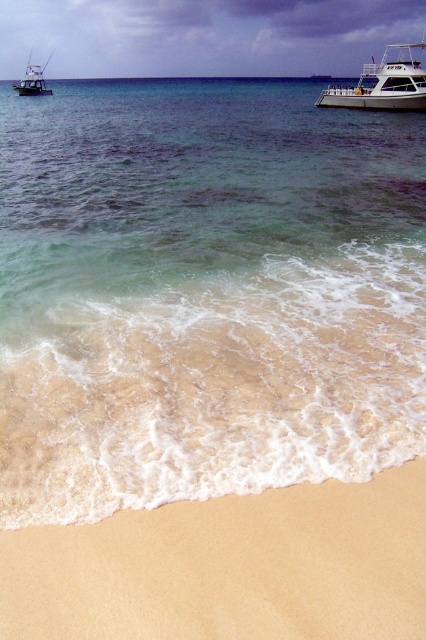
Between beige sandy beach at lower center and brushed metal boat at upper left, which one appears on the right side from the viewer's perspective?

beige sandy beach at lower center is more to the right.

Is the position of beige sandy beach at lower center less distant than that of brushed metal boat at upper left?

Yes, it is in front of brushed metal boat at upper left.

Is point (236, 620) less distant than point (28, 92)?

Yes, it is.

You are a GUI agent. You are given a task and a screenshot of the screen. Output one action in this format:
    pyautogui.click(x=<x>, y=<y>)
    Task: Click on the beige sandy beach at lower center
    Image resolution: width=426 pixels, height=640 pixels.
    Given the screenshot: What is the action you would take?
    (x=230, y=566)

Does beige sandy beach at lower center have a lesser width compared to white glossy boat at upper right?

Correct, beige sandy beach at lower center's width is less than white glossy boat at upper right's.

Based on the photo, who is positioned more to the left, beige sandy beach at lower center or white glossy boat at upper right?

beige sandy beach at lower center is more to the left.

Which is behind, point (187, 595) or point (402, 52)?

Point (402, 52)

In order to click on beige sandy beach at lower center in this screenshot , I will do point(230,566).

Where is `clear water at center`? The width and height of the screenshot is (426, 640). clear water at center is located at coordinates (204, 292).

Does clear water at center have a larger size compared to white glossy boat at upper right?

No.

This screenshot has height=640, width=426. Identify the location of clear water at center. point(204,292).